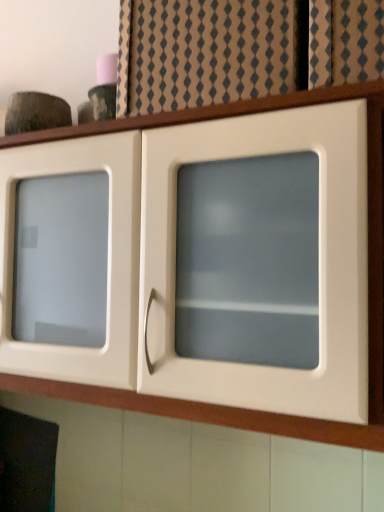
Question: Considering their positions, is white glossy cabinet at upper center located in front of or behind beige textured fabric at upper center?

Choices:
 (A) behind
 (B) front

Answer: (B)

Question: Does point (82, 388) appear closer or farther from the camera than point (256, 94)?

Choices:
 (A) closer
 (B) farther

Answer: (B)

Question: Is white glossy cabinet at upper center inside the boundaries of beige textured fabric at upper center, or outside?

Choices:
 (A) outside
 (B) inside

Answer: (A)

Question: Choose the correct answer: Is beige textured fabric at upper center inside white glossy cabinet at upper center or outside it?

Choices:
 (A) inside
 (B) outside

Answer: (B)

Question: Considering their positions, is beige textured fabric at upper center located in front of or behind white glossy cabinet at upper center?

Choices:
 (A) front
 (B) behind

Answer: (B)

Question: From the image's perspective, relative to white glossy cabinet at upper center, is beige textured fabric at upper center above or below?

Choices:
 (A) below
 (B) above

Answer: (B)

Question: Is beige textured fabric at upper center wider or thinner than white glossy cabinet at upper center?

Choices:
 (A) wide
 (B) thin

Answer: (B)